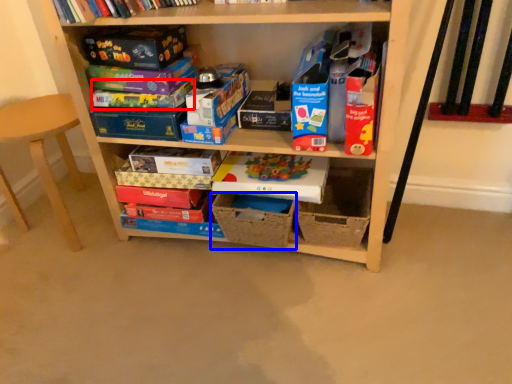
Question: Which object is closer to the camera taking this photo, paperback book (highlighted by a red box) or storage box (highlighted by a blue box)?

Choices:
 (A) paperback book
 (B) storage box

Answer: (A)